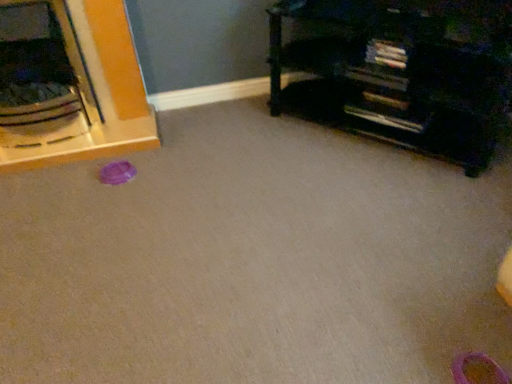
You are a GUI agent. You are given a task and a screenshot of the screen. Output one action in this format:
    pyautogui.click(x=<x>, y=<y>)
    Task: Click on the vacant space positioned to the left of pink rubber shoe at lower right
    The image size is (512, 384).
    Given the screenshot: What is the action you would take?
    pyautogui.click(x=406, y=357)